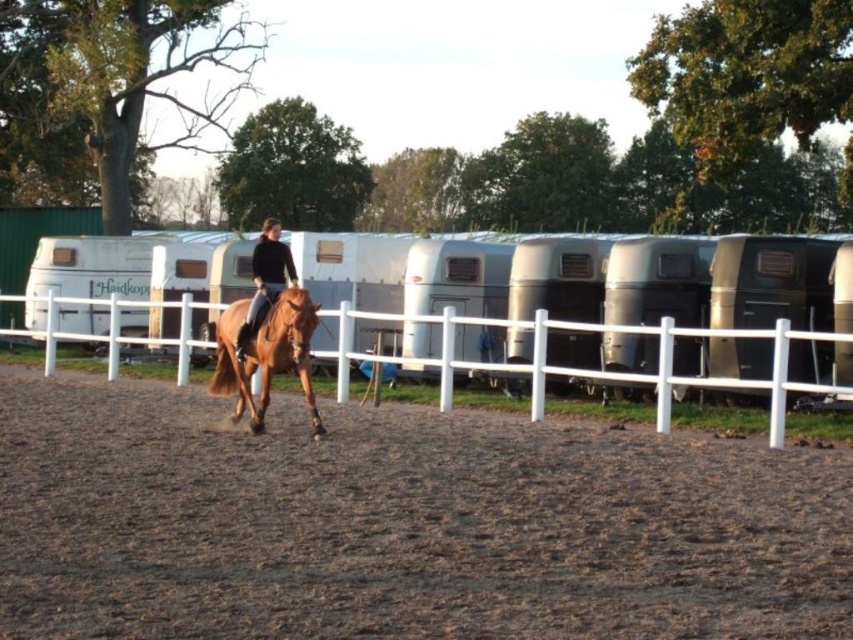
You are a photographer standing at the edge of the fenced area. You want to take a photo of the shiny brown horse at center and the brown sandy dirt at center. Which object should you focus on first to ensure both are in focus?

Since the brown sandy dirt at center is closer to the viewer than the shiny brown horse at center, you should focus on the brown sandy dirt at center first to ensure both are in focus.

From the picture: You are standing at the point marked as point (x=637, y=374) in the image. Looking around, you see a white plastic fence at center. What is the nearest object to you?

The nearest object to you is the white plastic fence at center because the point (x=637, y=374) is on it.

You are a photographer standing behind the white plastic fence at center, and you want to take a photo of the shiny brown horse at center. Can you see the horse clearly through the fence?

The white plastic fence at center is positioned under the shiny brown horse at center, so the fence is below the horse and does not block the view. Therefore, you can see the horse clearly through the fence.